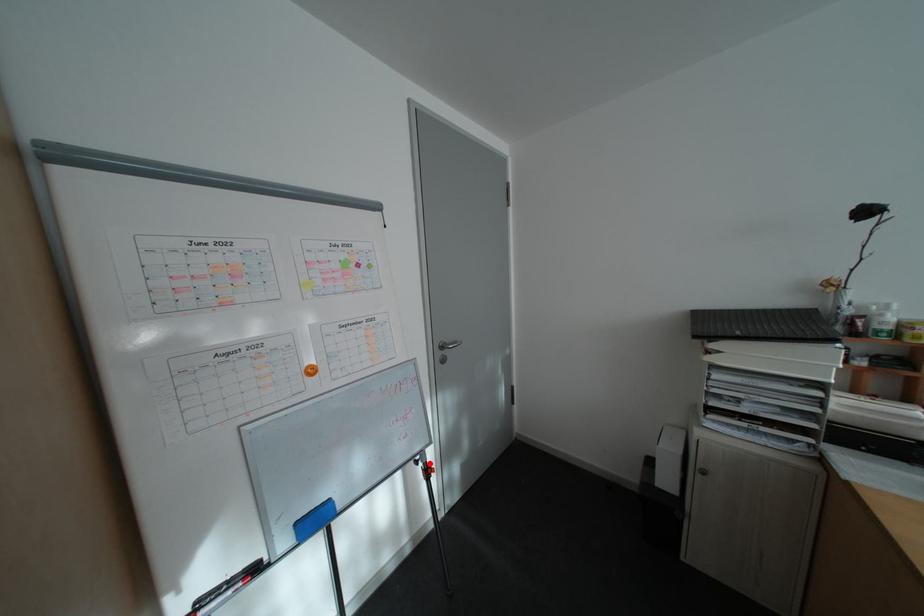
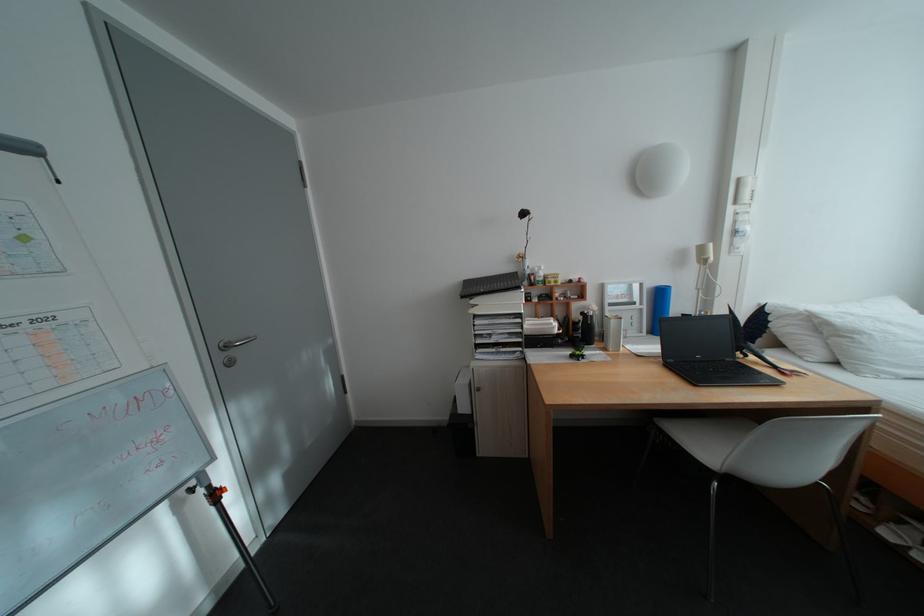
Question: I am providing you with two images of the same scene from different viewpoints. A red point is shown in image1. For the corresponding object point in image2, is it positioned nearer or farther from the camera?

Choices:
 (A) Nearer
 (B) Farther

Answer: (A)